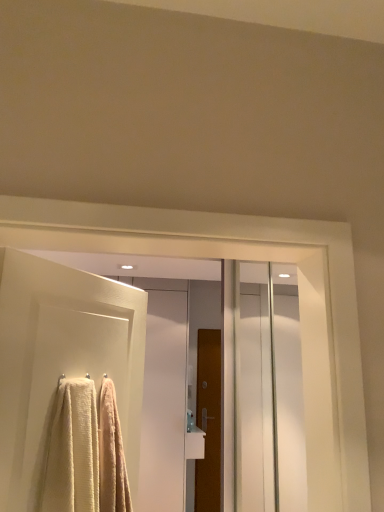
Question: From a real-world perspective, is white glossy screen door at center positioned over white textured towel at left, which ranks as the 2th door in right-to-left order, based on gravity?

Choices:
 (A) yes
 (B) no

Answer: (B)

Question: Is white glossy screen door at center oriented away from white textured towel at left, the 1th door viewed from the left?

Choices:
 (A) yes
 (B) no

Answer: (B)

Question: From a real-world perspective, is white glossy screen door at center below white textured towel at left, which ranks as the 2th door in right-to-left order?

Choices:
 (A) no
 (B) yes

Answer: (B)

Question: Is white glossy screen door at center far away from white textured towel at left, the 1th door viewed from the left?

Choices:
 (A) no
 (B) yes

Answer: (B)

Question: Would you say white glossy screen door at center contains white textured towel at left, arranged as the 2th door when ordered from the bottom?

Choices:
 (A) yes
 (B) no

Answer: (B)

Question: Is white glossy screen door at center facing towards white textured towel at left, which ranks as the 2th door in right-to-left order?

Choices:
 (A) no
 (B) yes

Answer: (B)

Question: Is brown wooden door at center, which ranks as the second door in left-to-right order, wider than white textured towel at left, the 1th door viewed from the left?

Choices:
 (A) no
 (B) yes

Answer: (B)

Question: Would you say white textured towel at left, the first door in the front-to-back sequence, is part of brown wooden door at center, the first door when ordered from back to front,'s contents?

Choices:
 (A) yes
 (B) no

Answer: (B)

Question: Is brown wooden door at center, placed as the first door when sorted from right to left, placed right next to white textured towel at left, arranged as the 2th door when ordered from the bottom?

Choices:
 (A) no
 (B) yes

Answer: (A)

Question: Is brown wooden door at center, which is the second door in front-to-back order, outside of white textured towel at left, which is the 2th door from back to front?

Choices:
 (A) no
 (B) yes

Answer: (B)

Question: From a real-world perspective, is brown wooden door at center, which ranks as the second door in left-to-right order, on top of white textured towel at left, which ranks as the 2th door in right-to-left order?

Choices:
 (A) yes
 (B) no

Answer: (B)

Question: From the image's perspective, is brown wooden door at center, the 1th door from the bottom, located above white textured towel at left, which is the 2th door from back to front?

Choices:
 (A) no
 (B) yes

Answer: (A)

Question: From a real-world perspective, is soft white towel at left on top of white textured towel at left, the 1th door viewed from the left?

Choices:
 (A) no
 (B) yes

Answer: (A)